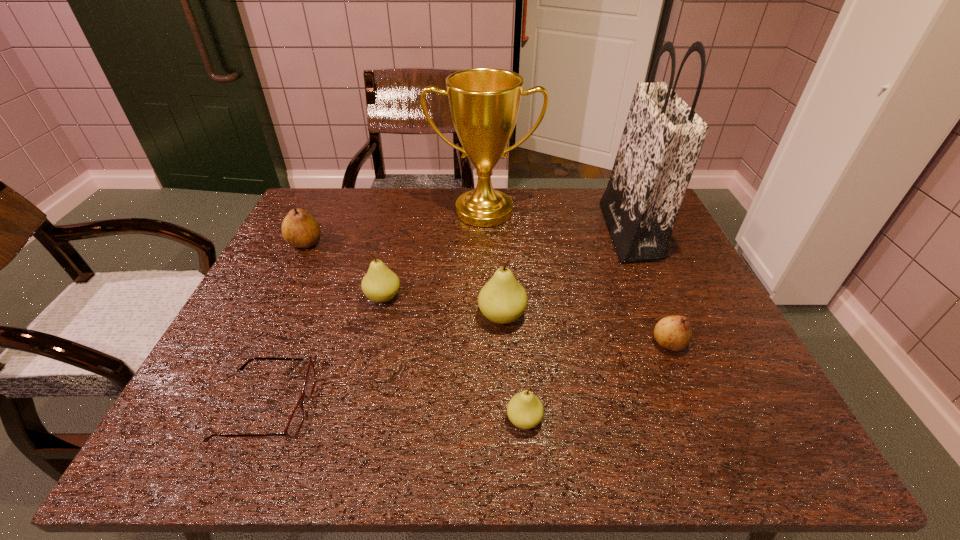
The image size is (960, 540). In order to click on the smaller brown pear in this screenshot , I will do `click(674, 333)`.

Where is `the smallest green pear`? the smallest green pear is located at coordinates (525, 410).

In order to click on the nearest green pear in this screenshot , I will do `click(525, 410)`.

I want to click on the shortest object, so click(294, 424).

Where is `red spectacles`? The height and width of the screenshot is (540, 960). red spectacles is located at coordinates coord(294,424).

Image resolution: width=960 pixels, height=540 pixels. I want to click on vacant space located on the front of the tallest object with the design, so (x=473, y=232).

Locate an element on the screen. The width and height of the screenshot is (960, 540). free space located 0.320m on the front of the tallest object with the design is located at coordinates (497, 232).

Find the location of a particular element. This screenshot has width=960, height=540. vacant space located 0.100m on the front of the tallest object with the design is located at coordinates (573, 232).

Where is `vacant space situated 0.180m by the handles of the gold award`? This screenshot has width=960, height=540. vacant space situated 0.180m by the handles of the gold award is located at coordinates (485, 270).

You are a GUI agent. You are given a task and a screenshot of the screen. Output one action in this format:
    pyautogui.click(x=<x>, y=<y>)
    Task: Click on the vacant space located 0.220m on the front of the sixth shortest object
    
    Given the screenshot: What is the action you would take?
    pyautogui.click(x=508, y=424)